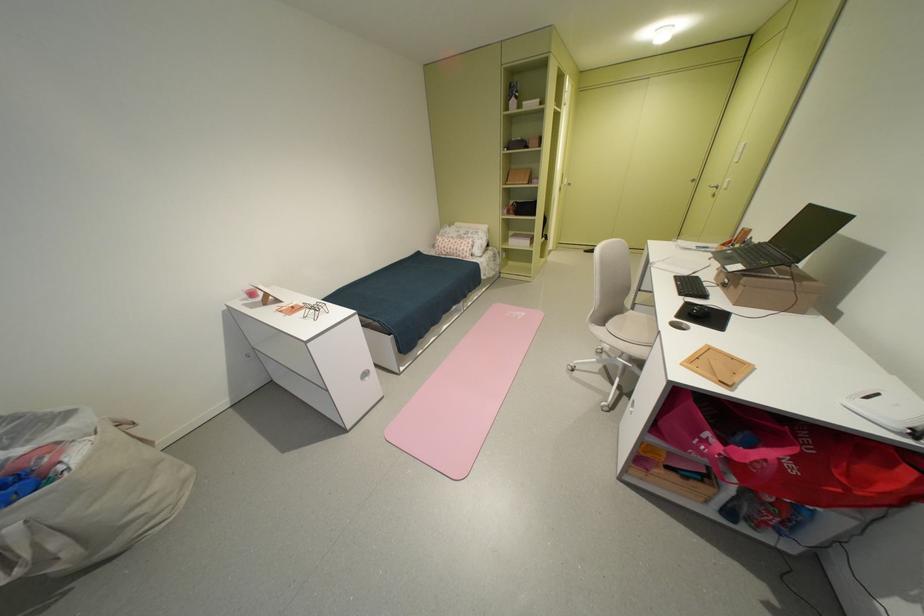
Where is `white chair sitting surface`? The height and width of the screenshot is (616, 924). white chair sitting surface is located at coordinates coord(633,326).